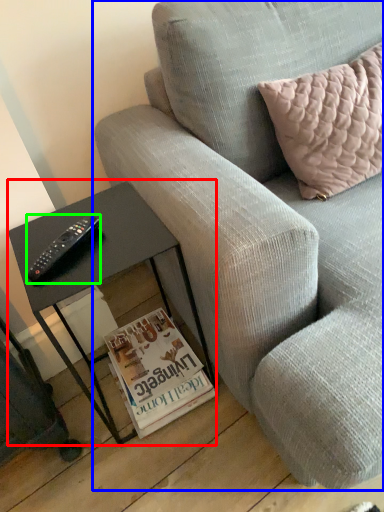
Question: Which is nearer to the table (highlighted by a red box)? studio couch (highlighted by a blue box) or remote (highlighted by a green box).

Choices:
 (A) studio couch
 (B) remote

Answer: (B)